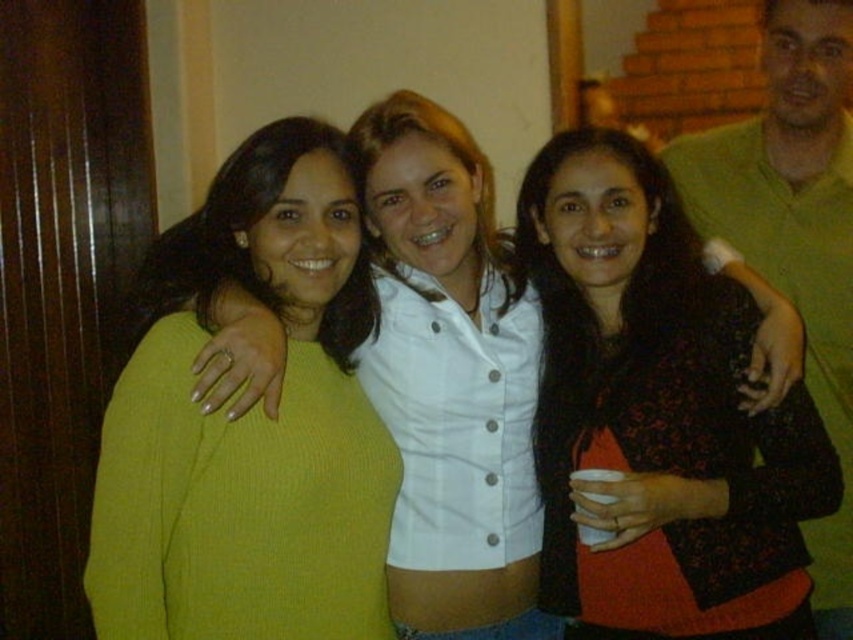
You are organizing a clothing donation drive and need to categorize items by size. You have a black textured sweater at center and a green matte shirt at upper right. Which item should you place in the large size bin?

The black textured sweater at center is larger in size than the green matte shirt at upper right, so the black textured sweater at center should be placed in the large size bin.

Consider the image. You are a photographer trying to capture a clear photo of the black textured sweater at center and the green matte shirt at upper right. Which one would appear larger in your photo?

The black textured sweater at center would appear larger in the photo because it is closer to the viewer than the green matte shirt at upper right.

You are a photographer adjusting the camera focus. You need to ensure that both the green ribbed sweater at left and the black textured sweater at center are in focus. Which sweater should you focus on first to achieve this?

The green ribbed sweater at left is above the black textured sweater at center, so focusing on the green ribbed sweater at left first will help ensure both are in focus as it is closer to the camera.